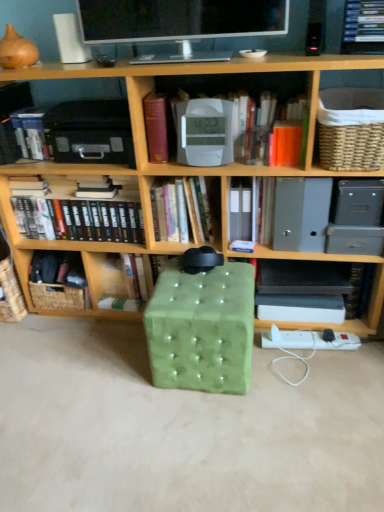
Where is `free spot above woven brown basket at lower left, the 1th basket in the left-to-right sequence (from a real-world perspective)`? The image size is (384, 512). free spot above woven brown basket at lower left, the 1th basket in the left-to-right sequence (from a real-world perspective) is located at coordinates (76, 271).